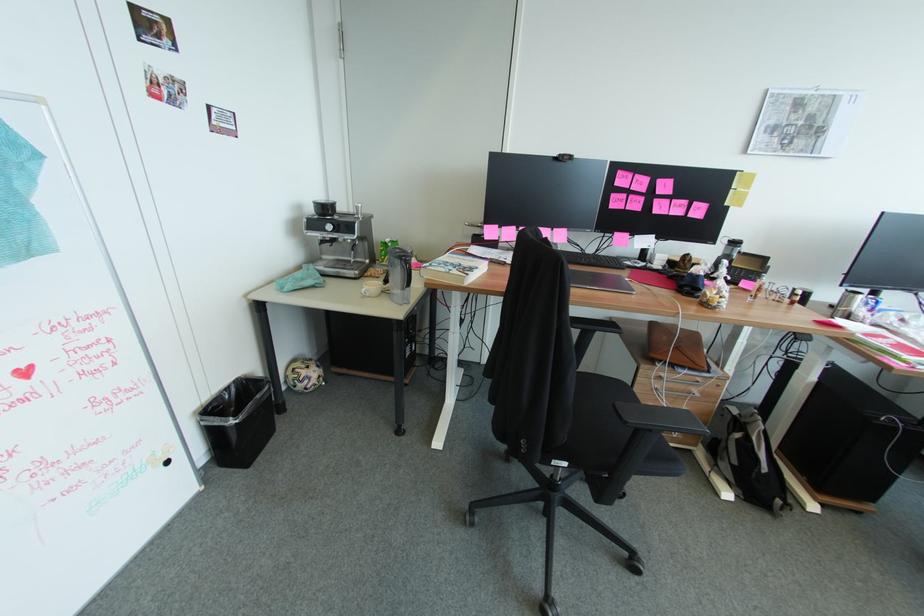
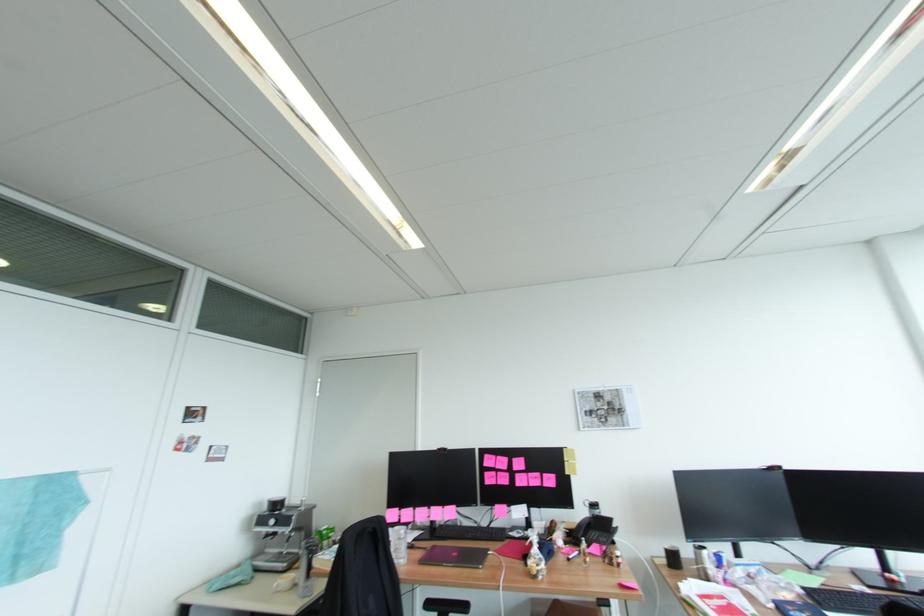
Where in the second image is the point corresponding to (369,290) from the first image?

(282, 583)